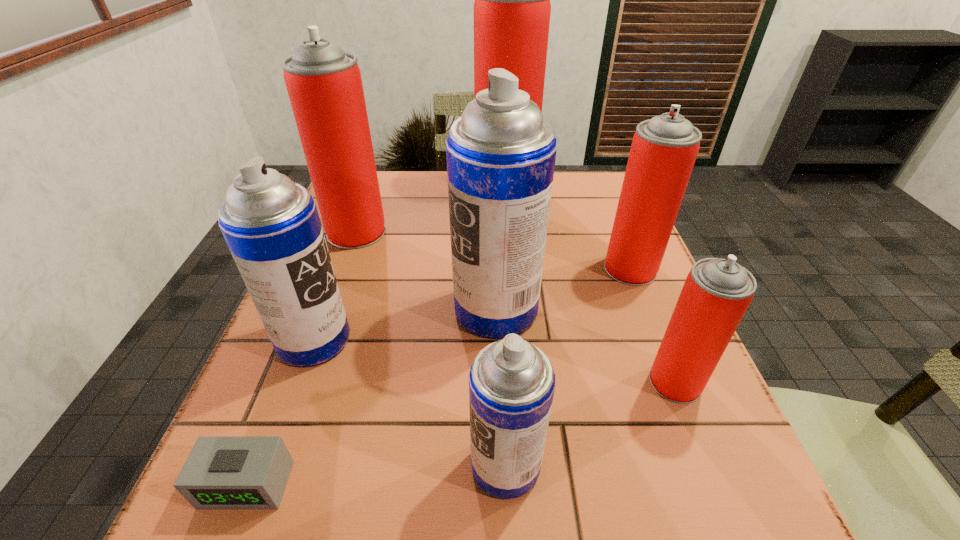
This screenshot has height=540, width=960. In order to click on vacant region located on the label side of the smallest blue aerosol can in this screenshot , I will do `click(291, 465)`.

This screenshot has height=540, width=960. In order to click on free space located 0.340m on the label side of the smallest blue aerosol can in this screenshot , I will do `click(236, 465)`.

Image resolution: width=960 pixels, height=540 pixels. In order to click on aerosol can that is at the near edge in this screenshot , I will do `click(511, 382)`.

Identify the location of alarm clock present at the near edge. (221, 472).

You are a GUI agent. You are given a task and a screenshot of the screen. Output one action in this format:
    pyautogui.click(x=<x>, y=<y>)
    Task: Click on the alarm clock positioned at the left edge
    This screenshot has width=960, height=540.
    Given the screenshot: What is the action you would take?
    pyautogui.click(x=221, y=472)

This screenshot has width=960, height=540. What are the coordinates of `object at the far left corner` in the screenshot? It's located at (324, 84).

This screenshot has width=960, height=540. Identify the location of object located in the near left corner section of the desktop. (221, 472).

Find the location of a particular element. This screenshot has width=960, height=540. vacant space at the far edge of the desktop is located at coordinates (436, 204).

Where is `free location at the near edge of the desktop`? free location at the near edge of the desktop is located at coordinates (502, 530).

At what (x,y) coordinates should I click in order to perform the action: click on vacant area at the left edge of the desktop. Please return your answer as a coordinate pair (x, y). Looking at the image, I should click on (342, 404).